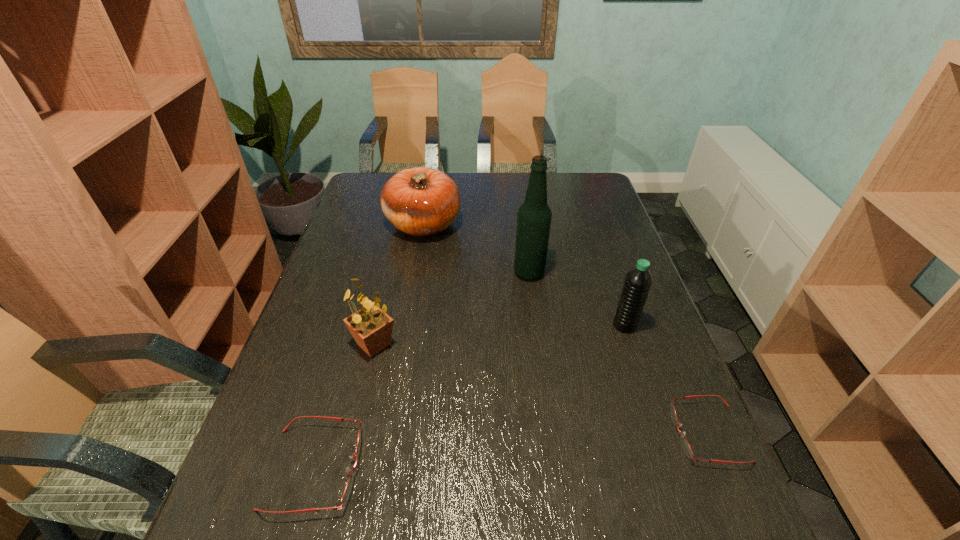
Locate an element on the screen. vacant spot for a new spectacles to ensure equal spacing is located at coordinates (517, 450).